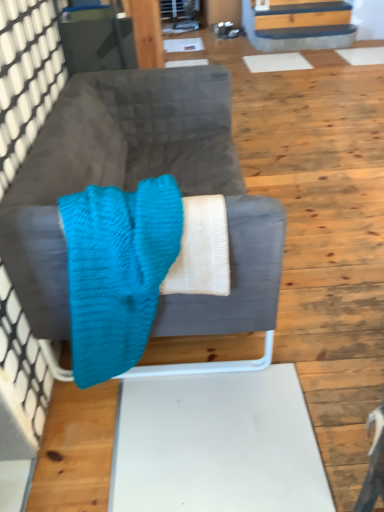
Question: From the image's perspective, relative to turquoise knitted blanket at center, is velvet gray couch at center above or below?

Choices:
 (A) above
 (B) below

Answer: (A)

Question: From their relative heights in the image, would you say velvet gray couch at center is taller or shorter than turquoise knitted blanket at center?

Choices:
 (A) tall
 (B) short

Answer: (A)

Question: Considering their positions, is velvet gray couch at center located in front of or behind turquoise knitted blanket at center?

Choices:
 (A) front
 (B) behind

Answer: (B)

Question: In terms of size, does turquoise knitted blanket at center appear bigger or smaller than velvet gray couch at center?

Choices:
 (A) small
 (B) big

Answer: (A)

Question: Considering the positions of turquoise knitted blanket at center and velvet gray couch at center in the image, is turquoise knitted blanket at center taller or shorter than velvet gray couch at center?

Choices:
 (A) short
 (B) tall

Answer: (A)

Question: In the image, is turquoise knitted blanket at center positioned in front of or behind velvet gray couch at center?

Choices:
 (A) front
 (B) behind

Answer: (A)

Question: Is turquoise knitted blanket at center spatially inside velvet gray couch at center, or outside of it?

Choices:
 (A) outside
 (B) inside

Answer: (B)